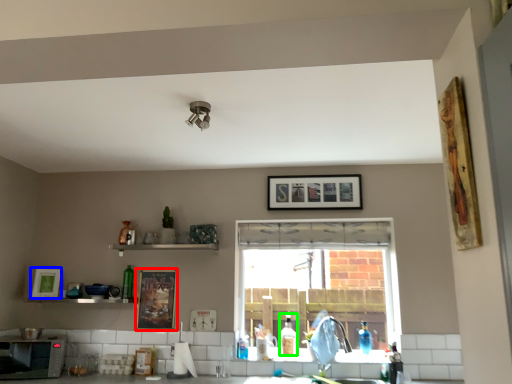
Question: Considering the real-world distances, which object is farthest from picture frame (highlighted by a red box)? picture frame (highlighted by a blue box) or bottle (highlighted by a green box)?

Choices:
 (A) picture frame
 (B) bottle

Answer: (B)